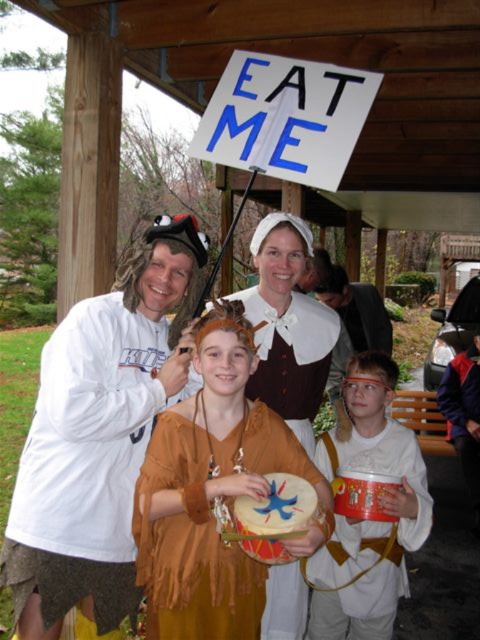
You are organizing a costume party and need to ensure that all items fit on a display table. The matte brown dress at center and the orange fabric drum at center are both required to be placed on the table. Given that the table has limited space, which item should you prioritize placing first to maximize space efficiency?

The orange fabric drum at center is smaller than the matte brown dress at center, so you should prioritize placing the matte brown dress at center first to ensure it fits properly before arranging the smaller orange fabric drum at center.

From the picture: You are a costume designer measuring the distance between the brown leather skirt at left and the brown suede drum at center for a stage performance. The minimum required distance between props and costumes for safety is 12 inches. Can the current placement meet the requirement?

The brown leather skirt at left and brown suede drum at center are 12.26 inches apart, which exceeds the minimum required distance of 12 inches. Therefore, the current placement meets the safety requirement.